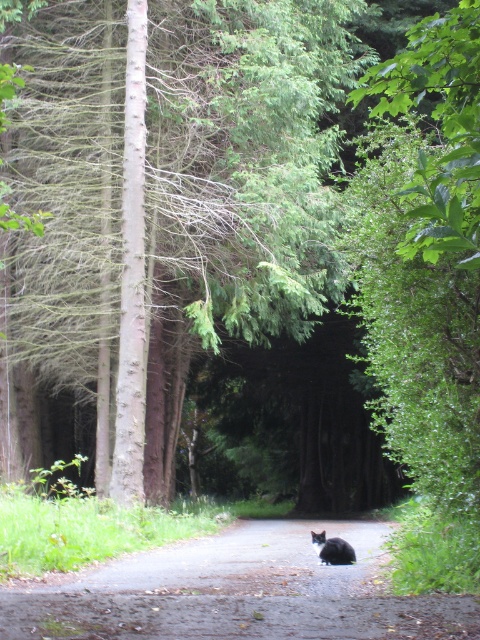
Question: Does brown rough tree at center come behind dirt road at center?

Choices:
 (A) no
 (B) yes

Answer: (B)

Question: Which point is closer to the camera?

Choices:
 (A) (311, 531)
 (B) (251, 196)
 (C) (31, 609)

Answer: (C)

Question: Can you confirm if brown rough tree at center is positioned above black fur cat at center?

Choices:
 (A) no
 (B) yes

Answer: (B)

Question: Which point appears closest to the camera in this image?

Choices:
 (A) (344, 547)
 (B) (361, 582)
 (C) (112, 160)

Answer: (B)

Question: Can you confirm if dirt road at center is wider than black fur cat at center?

Choices:
 (A) yes
 (B) no

Answer: (A)

Question: Which object is the closest to the brown rough tree at center?

Choices:
 (A) dirt road at center
 (B) black fur cat at center

Answer: (A)